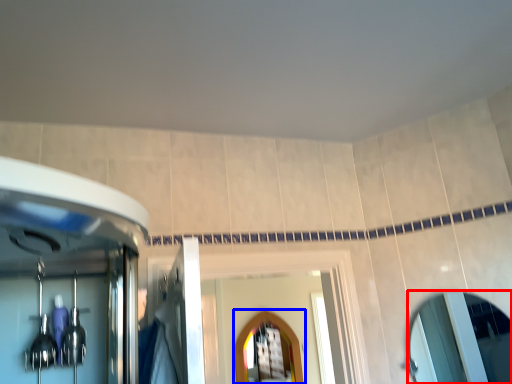
Question: Which object appears closest to the camera in this image, mirror (highlighted by a red box) or mirror (highlighted by a blue box)?

Choices:
 (A) mirror
 (B) mirror

Answer: (A)